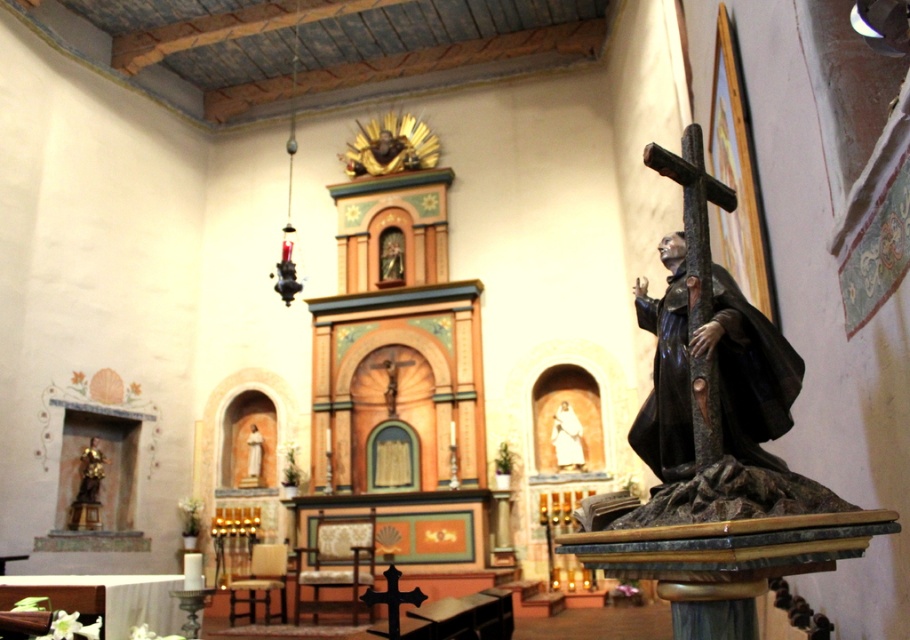
Where is `gold leaf statue at upper center`? gold leaf statue at upper center is located at coordinates (379, 154).

Consider the image. Measure the distance between point (359, 140) and camera.

The distance of point (359, 140) from camera is 13.50 meters.

Which is behind, point (403, 147) or point (94, 444)?

The point (403, 147) is behind.

Identify the location of gold leaf statue at upper center. 379,154.

Can you confirm if white cloth figure at center is thinner than smooth white statue at center?

No.

Which is in front, point (578, 420) or point (251, 449)?

Positioned in front is point (578, 420).

The width and height of the screenshot is (910, 640). Identify the location of white cloth figure at center. (567, 438).

Where is `white cloth figure at center`? The width and height of the screenshot is (910, 640). white cloth figure at center is located at coordinates (567, 438).

Does gold statue at left have a lesser height compared to smooth white statue at center?

No, gold statue at left is not shorter than smooth white statue at center.

Does gold statue at left appear on the left side of smooth white statue at center?

Yes, gold statue at left is to the left of smooth white statue at center.

This screenshot has width=910, height=640. Identify the location of gold statue at left. (91, 472).

The width and height of the screenshot is (910, 640). I want to click on gold statue at left, so click(x=91, y=472).